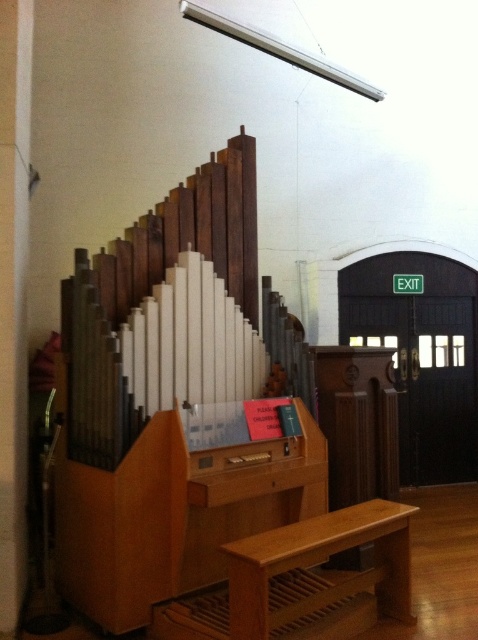
Question: Is light brown wood church bench at lower center in front of wooden stairs at lower center?

Choices:
 (A) no
 (B) yes

Answer: (B)

Question: Is light brown wood church bench at lower center smaller than wooden stairs at lower center?

Choices:
 (A) yes
 (B) no

Answer: (B)

Question: Which point is farther to the camera?

Choices:
 (A) wooden stairs at lower center
 (B) light brown wood church bench at lower center

Answer: (A)

Question: Can you confirm if light brown wood church bench at lower center is positioned to the right of wooden stairs at lower center?

Choices:
 (A) yes
 (B) no

Answer: (A)